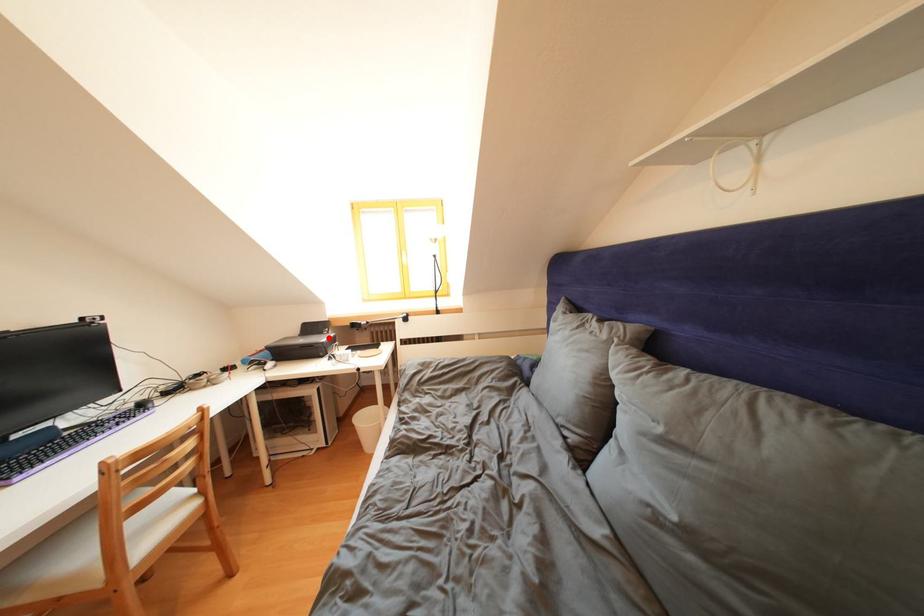
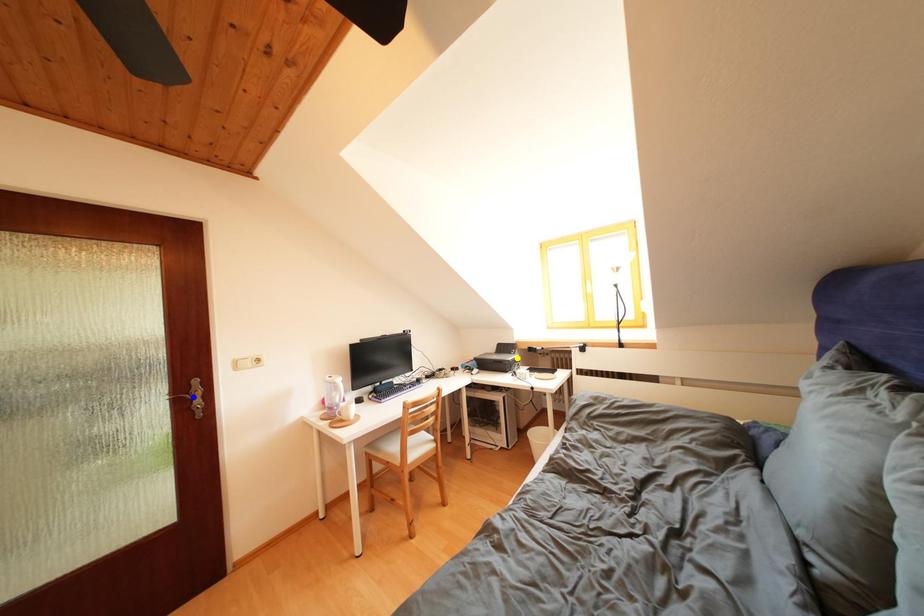
Question: I am providing you with two images of the same scene from different viewpoints. A red point is marked on the first image. You are given multiple points on the second image. Which mark in image 2 goes with the point in image 1?

Choices:
 (A) green point
 (B) blue point
 (C) yellow point

Answer: (C)